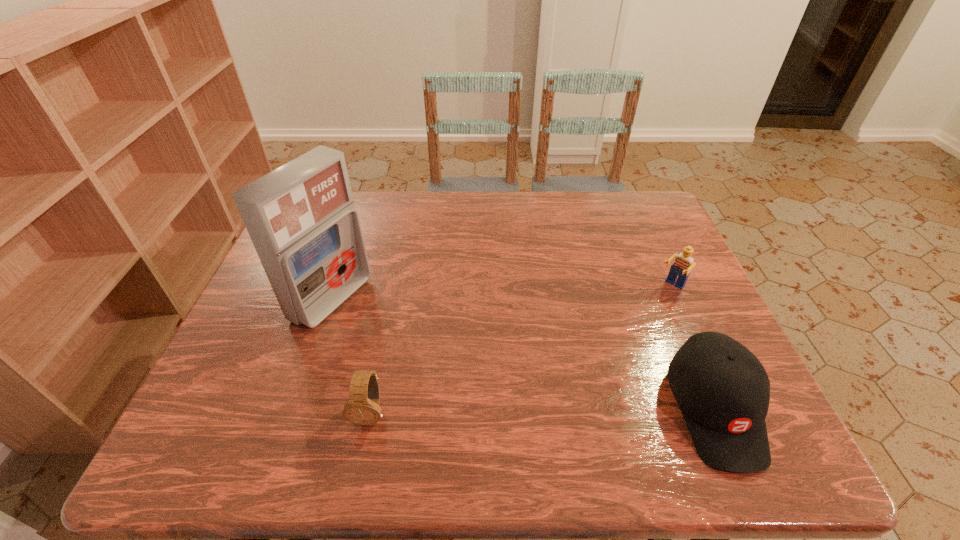
At what (x,y) coordinates should I click in order to perform the action: click on the third object from right to left. Please return your answer as a coordinate pair (x, y). This screenshot has width=960, height=540. Looking at the image, I should click on (362, 408).

This screenshot has width=960, height=540. I want to click on baseball cap, so click(x=723, y=391).

Locate an element on the screen. The height and width of the screenshot is (540, 960). the leftmost object is located at coordinates (301, 218).

Locate an element on the screen. The height and width of the screenshot is (540, 960). the first-aid kit is located at coordinates (301, 218).

The image size is (960, 540). I want to click on Lego, so click(683, 264).

This screenshot has width=960, height=540. I want to click on free space located on the front-facing side of the first-aid kit, so click(x=415, y=343).

Where is `vacant space situated 0.080m on the front-facing side of the first-aid kit`? The image size is (960, 540). vacant space situated 0.080m on the front-facing side of the first-aid kit is located at coordinates (384, 328).

You are a GUI agent. You are given a task and a screenshot of the screen. Output one action in this format:
    pyautogui.click(x=<x>, y=<y>)
    Task: Click on the free space located on the front-facing side of the first-aid kit
    This screenshot has height=540, width=960.
    Given the screenshot: What is the action you would take?
    pyautogui.click(x=504, y=387)

The width and height of the screenshot is (960, 540). I want to click on free region located on the face of the Lego, so click(x=651, y=307).

The height and width of the screenshot is (540, 960). I want to click on vacant space located on the face of the Lego, so click(572, 384).